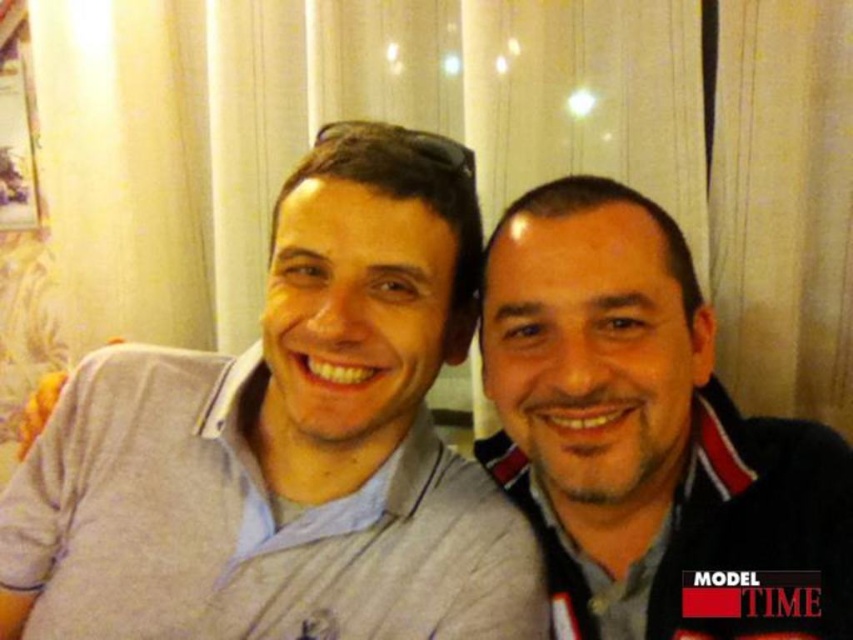
You are standing in front of a group photo and need to determine the order of the people from closest to farthest from you. The photo includes a gray cotton shirt at left and a matte black jacket at right. Which person is closer to you?

The gray cotton shirt at left is closer to you because it is positioned further to the viewer than the matte black jacket at right, meaning it appears nearer in the image.

Looking at this image, you are a photographer adjusting the camera focus. The gray cotton shirt at left and the matte black jacket at right are in the frame. Which one should you focus on first if you want to ensure the taller object is sharp?

The gray cotton shirt at left is taller than the matte black jacket at right, so focus on the gray cotton shirt at left first to ensure it is sharp.

You are a photographer setting up for a group photo. You notice the gray cotton shirt at left and the matte black jacket at right. Which clothing item is positioned lower in the frame?

The gray cotton shirt at left is located below the matte black jacket at right, so it is positioned lower in the frame.